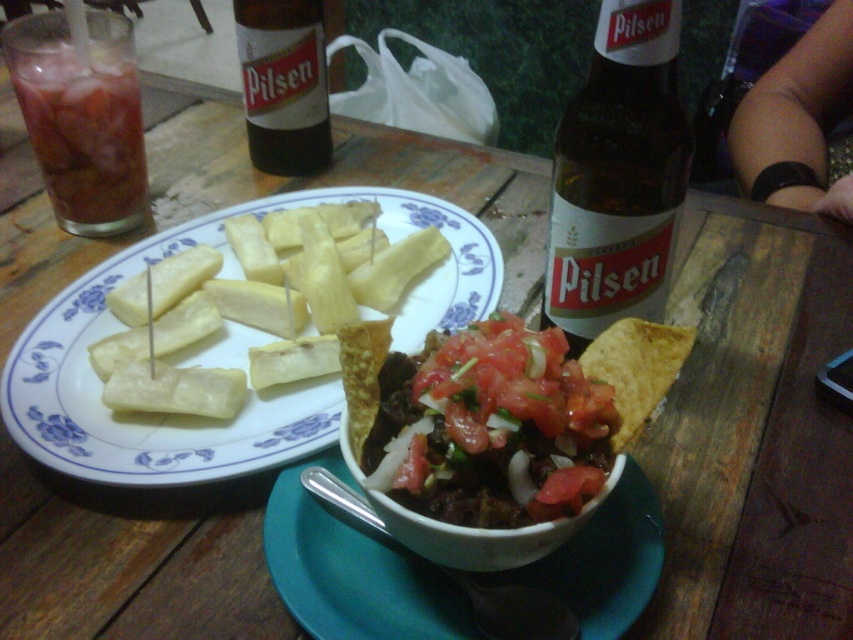
Question: Which object is the closest to the translucent glass bottle at upper center?

Choices:
 (A) yellow wax cheese at center
 (B) brown glass bottle at upper center

Answer: (A)

Question: Does yellow rubbery plantains at center appear under yellow wax cheese at center?

Choices:
 (A) yes
 (B) no

Answer: (A)

Question: Which object is the farthest from the yellow wax cheese at center?

Choices:
 (A) slightly crispy tortilla chips at center
 (B) translucent glass bottle at upper center
 (C) yellow rubbery plantains at center
 (D) brown glass bottle at upper center

Answer: (B)

Question: Does translucent glass with ice at upper left appear on the left side of brown glass bottle at upper center?

Choices:
 (A) no
 (B) yes

Answer: (B)

Question: In this image, where is translucent glass bottle at upper center located relative to translucent glass with ice at upper left?

Choices:
 (A) left
 (B) right

Answer: (B)

Question: Which object is positioned closest to the brown glass bottle at upper center?

Choices:
 (A) yellow rubbery plantains at center
 (B) translucent glass bottle at upper center
 (C) slightly crispy tortilla chips at center
 (D) yellow wax cheese at center

Answer: (D)